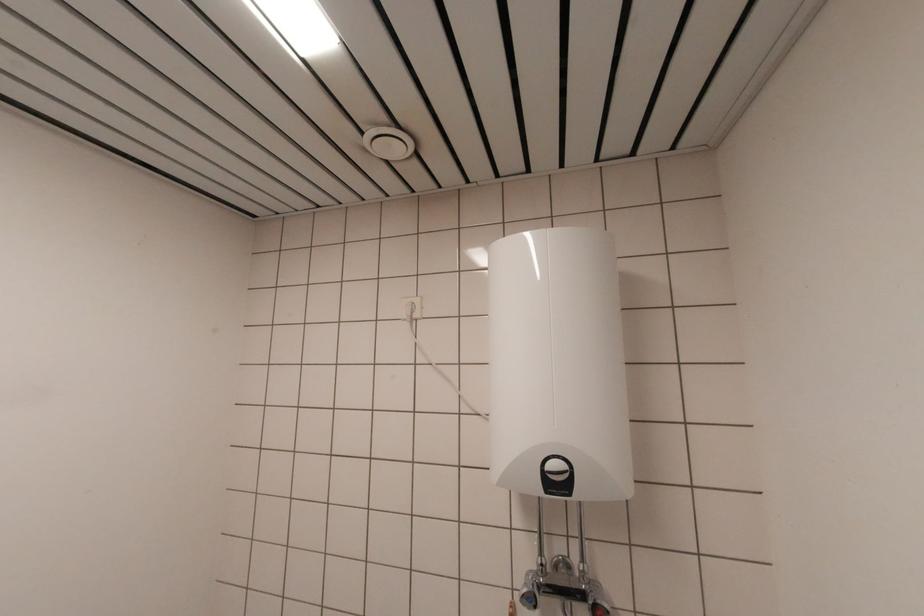
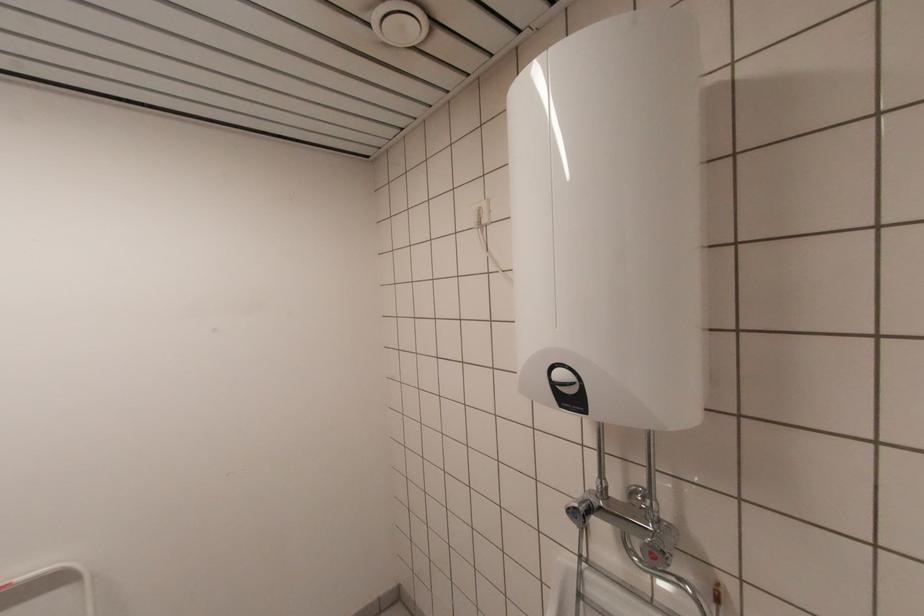
Question: The camera is either moving clockwise (left) or counter-clockwise (right) around the object. The first image is from the beginning of the video and the second image is from the end. Is the camera moving left or right when shooting the video?

Choices:
 (A) Left
 (B) Right

Answer: (B)